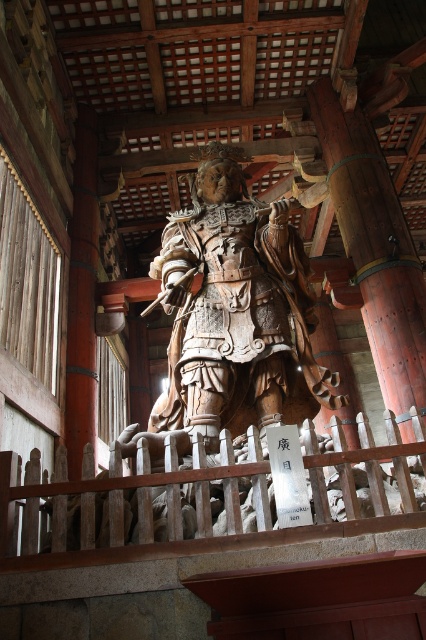
Question: Is wooden statue at center further to camera compared to wooden at center?

Choices:
 (A) no
 (B) yes

Answer: (B)

Question: Is wooden statue at center smaller than wooden at center?

Choices:
 (A) yes
 (B) no

Answer: (B)

Question: Which of the following is the farthest from the observer?

Choices:
 (A) wooden at center
 (B) wooden statue at center

Answer: (B)

Question: Can you confirm if wooden statue at center is wider than wooden at center?

Choices:
 (A) yes
 (B) no

Answer: (B)

Question: Which point is closer to the camera taking this photo?

Choices:
 (A) (206, 241)
 (B) (40, 520)

Answer: (B)